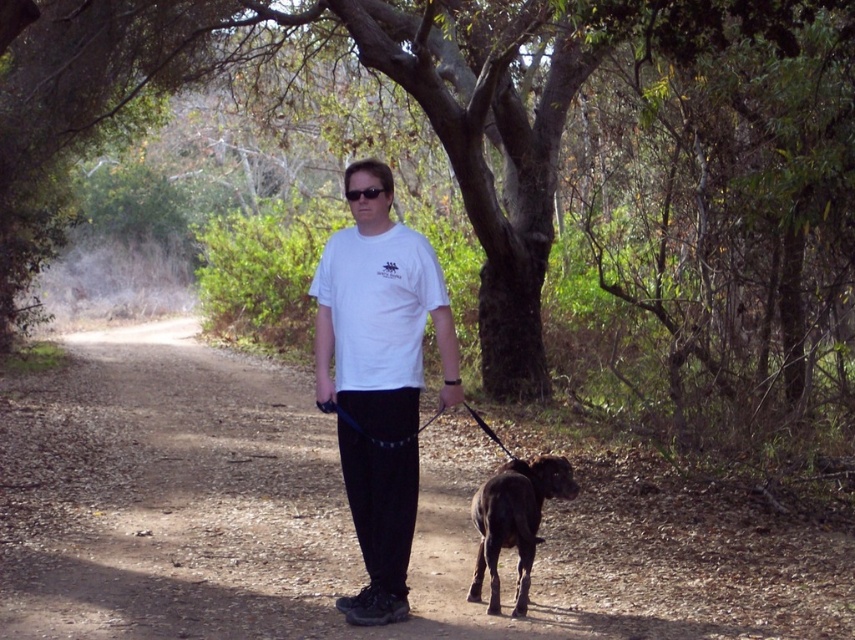
You are a hiker who has just started walking along the dirt path and want to reach the green textured tree at center. Based on your current position, in which direction should you head to reach the tree?

The green textured tree at center is located at point coordinates of 0.216 on the x axis and 0.605 on the y axis. Since you are starting at the beginning of the dirt path, you should head towards the center of the image where the tree is positioned.

You are standing at point (516, 138) in the image. What object is located exactly at this point?

The green textured tree at center is located exactly at point (516, 138).